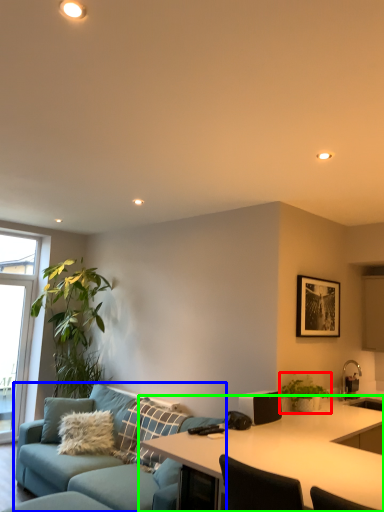
Question: Considering the real-world distances, which object is farthest from houseplant (highlighted by a red box)? studio couch (highlighted by a blue box) or desk (highlighted by a green box)?

Choices:
 (A) studio couch
 (B) desk

Answer: (A)